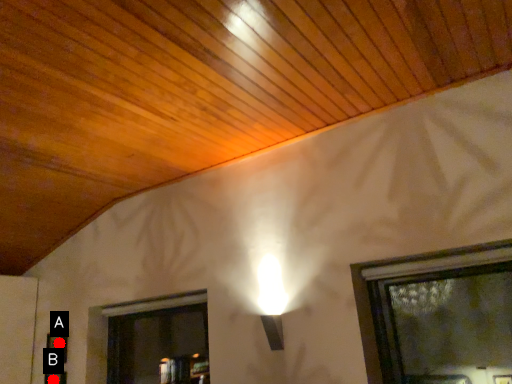
Question: Two points are circled on the image, labeled by A and B beside each circle. Among these points, which one is farthest from the camera?

Choices:
 (A) A is further
 (B) B is further

Answer: (A)